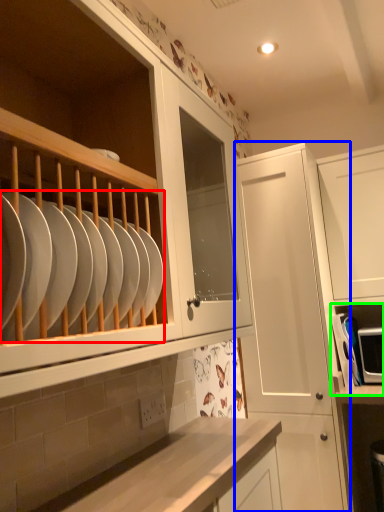
Question: Which object is positioned farthest from tableware (highlighted by a red box)? Select from cabinetry (highlighted by a blue box) and shelf (highlighted by a green box).

Choices:
 (A) cabinetry
 (B) shelf

Answer: (B)